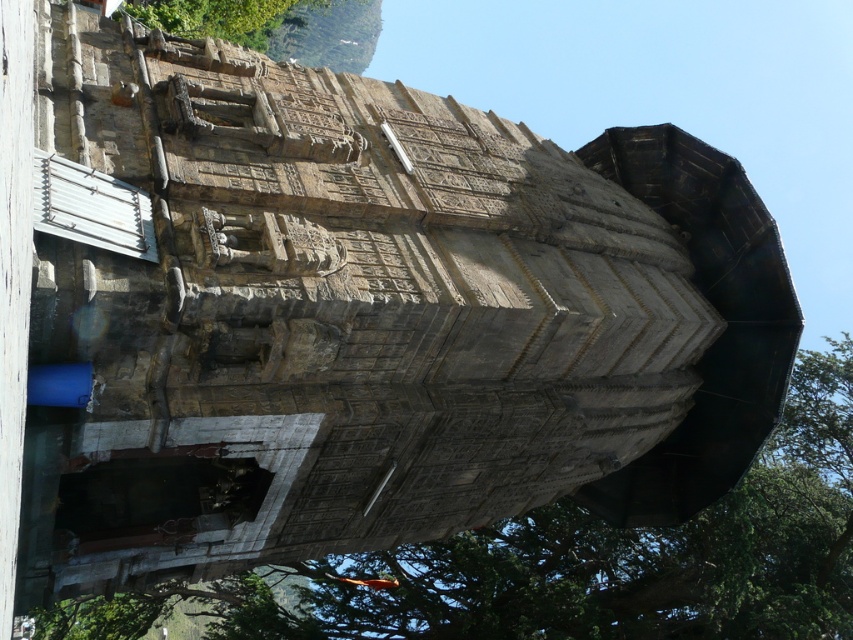
Is green leafy tree at lower left to the right of green leafy tree at upper center from the viewer's perspective?

Yes, green leafy tree at lower left is to the right of green leafy tree at upper center.

Measure the distance from green leafy tree at lower left to green leafy tree at upper center.

A distance of 78.77 meters exists between green leafy tree at lower left and green leafy tree at upper center.

At what (x,y) coordinates should I click in order to perform the action: click on green leafy tree at lower left. Please return your answer as a coordinate pair (x, y). The width and height of the screenshot is (853, 640). Looking at the image, I should click on (573, 561).